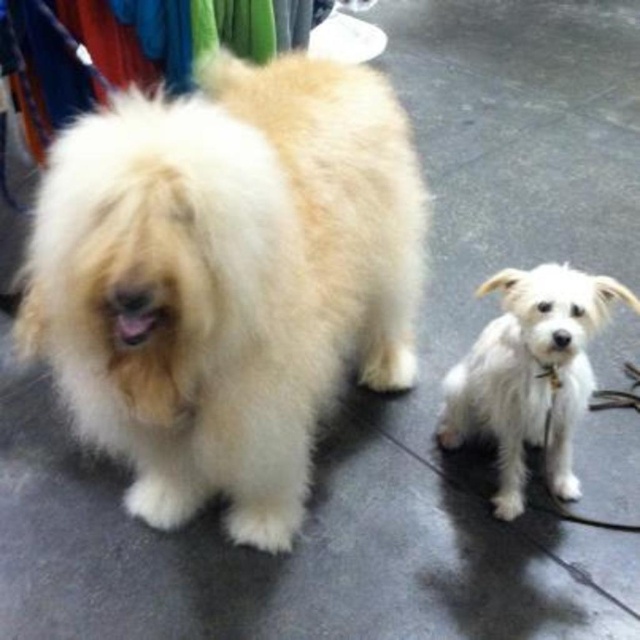
Can you confirm if fluffy white fur dog at center is shorter than white fluffy dog at lower right?

No, fluffy white fur dog at center is not shorter than white fluffy dog at lower right.

What do you see at coordinates (227, 278) in the screenshot? I see `fluffy white fur dog at center` at bounding box center [227, 278].

Locate an element on the screen. fluffy white fur dog at center is located at coordinates (227, 278).